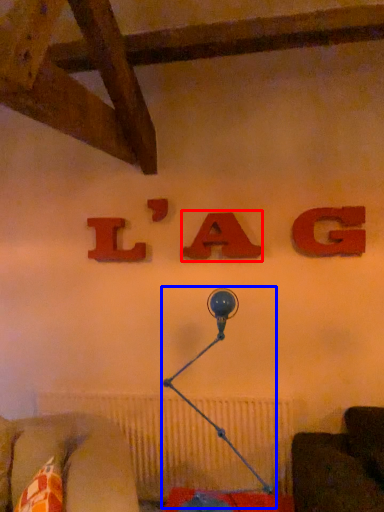
Question: Which object appears farthest to the camera in this image, alphabet (highlighted by a red box) or table lamp (highlighted by a blue box)?

Choices:
 (A) alphabet
 (B) table lamp

Answer: (A)